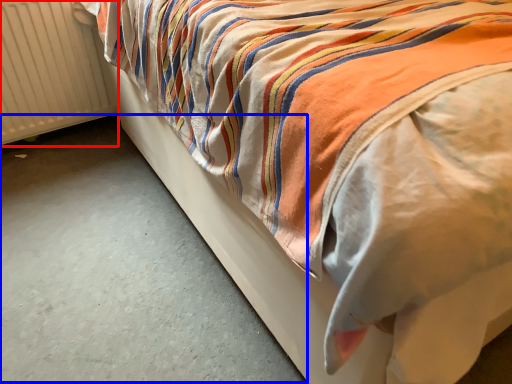
Question: Which object is further to the camera taking this photo, radiator (highlighted by a red box) or concrete (highlighted by a blue box)?

Choices:
 (A) radiator
 (B) concrete

Answer: (A)